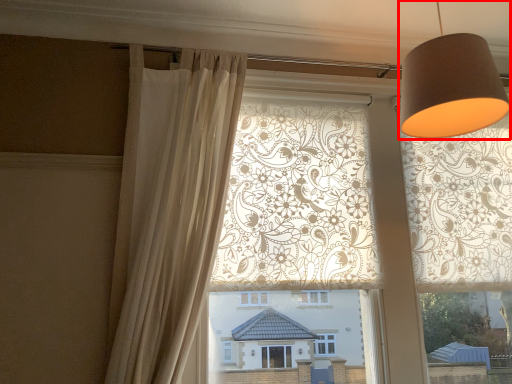
Question: From the image's perspective, what is the correct spatial positioning of table lamp (annotated by the red box) in reference to curtain?

Choices:
 (A) above
 (B) below

Answer: (A)